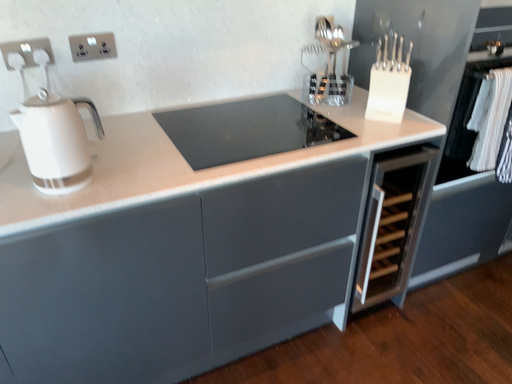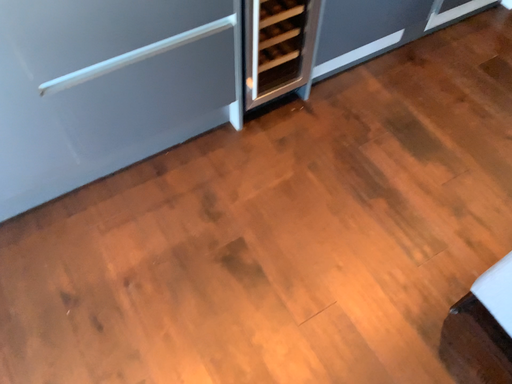
Question: How did the camera likely rotate when shooting the video?

Choices:
 (A) rotated downward
 (B) rotated upward

Answer: (A)